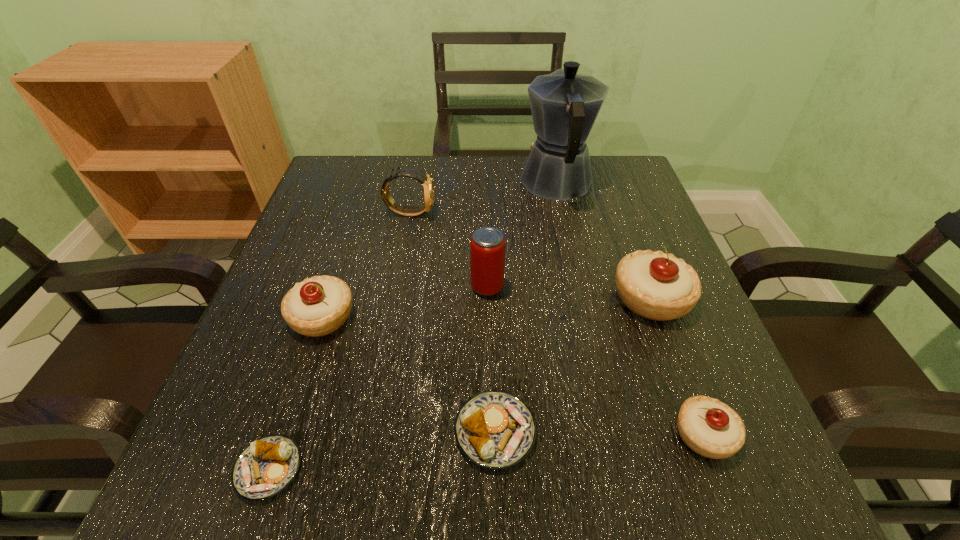
Locate an element on the screen. Image resolution: width=960 pixels, height=540 pixels. free spot that satisfies the following two spatial constraints: 1. on the face of the watch; 2. on the front side of the second biggest beige pastry is located at coordinates (391, 317).